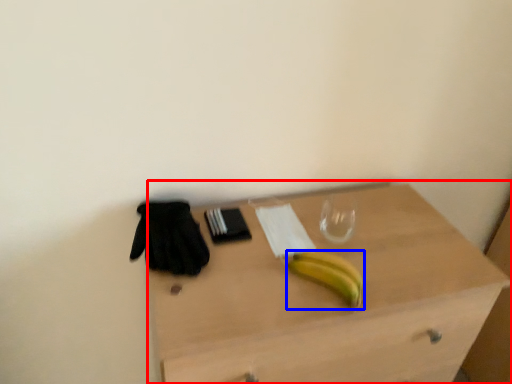
Question: Which object is closer to the camera taking this photo, desk (highlighted by a red box) or banana (highlighted by a blue box)?

Choices:
 (A) desk
 (B) banana

Answer: (A)